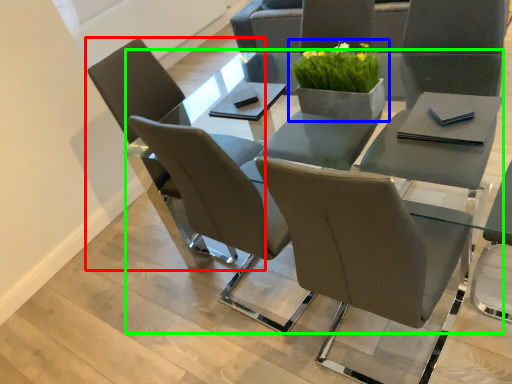
Question: Estimate the real-world distances between objects in this image. Which object is closer to chair (highlighted by a red box), houseplant (highlighted by a blue box) or round table (highlighted by a green box)?

Choices:
 (A) houseplant
 (B) round table

Answer: (A)